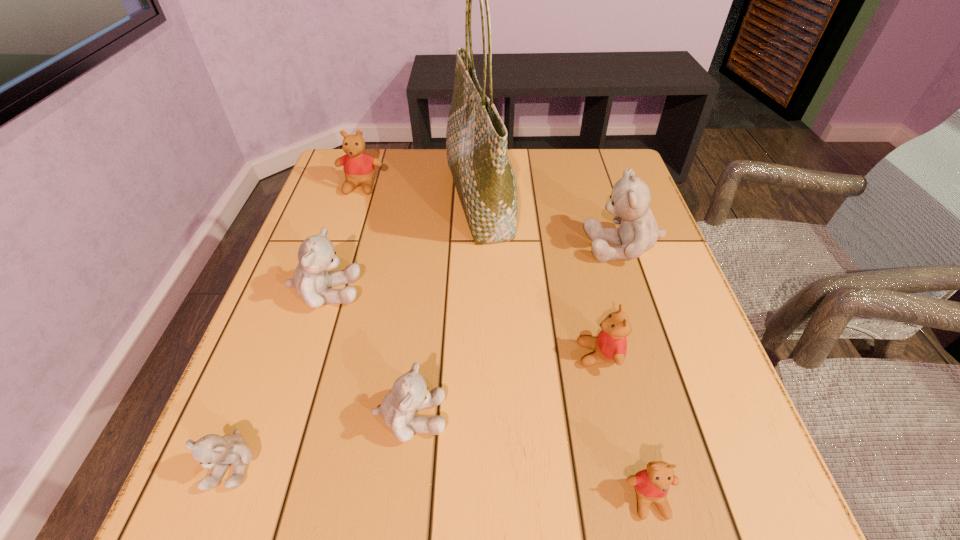
Where is `free space that is in between the shopping bag and the second farthest gray teddy bear`? This screenshot has height=540, width=960. free space that is in between the shopping bag and the second farthest gray teddy bear is located at coordinates (402, 246).

Where is `free space between the nearest red teddy bear and the fourth nearest object`? Image resolution: width=960 pixels, height=540 pixels. free space between the nearest red teddy bear and the fourth nearest object is located at coordinates (624, 427).

Where is `free spot between the tallest object and the smallest red teddy bear`? Image resolution: width=960 pixels, height=540 pixels. free spot between the tallest object and the smallest red teddy bear is located at coordinates [564, 349].

Where is `vacant space that is in between the farthest teddy bear and the smallest gray teddy bear`? The image size is (960, 540). vacant space that is in between the farthest teddy bear and the smallest gray teddy bear is located at coordinates (297, 325).

Where is `free area in between the smallest gray teddy bear and the nearest red teddy bear`? This screenshot has height=540, width=960. free area in between the smallest gray teddy bear and the nearest red teddy bear is located at coordinates (441, 481).

You are a GUI agent. You are given a task and a screenshot of the screen. Output one action in this format:
    pyautogui.click(x=<x>, y=<y>)
    Task: Click on the sixth closest object relative to the second farthest teddy bear
    This screenshot has height=540, width=960.
    Given the screenshot: What is the action you would take?
    pyautogui.click(x=358, y=166)

Identify the location of the third closest object relative to the nearest red teddy bear. The width and height of the screenshot is (960, 540). (629, 202).

Point out which teddy bear is positioned as the second nearest to the smallest red teddy bear. Please provide its 2D coordinates. Your answer should be formatted as a tuple, i.e. [(x, y)], where the tuple contains the x and y coordinates of a point satisfying the conditions above.

[(409, 394)]

Locate which teddy bear is the fifth closest to the second smallest gray teddy bear. Please provide its 2D coordinates. Your answer should be formatted as a tuple, i.e. [(x, y)], where the tuple contains the x and y coordinates of a point satisfying the conditions above.

[(629, 202)]

Locate which gray teddy bear is the closest to the second biggest gray teddy bear. Please provide its 2D coordinates. Your answer should be formatted as a tuple, i.e. [(x, y)], where the tuple contains the x and y coordinates of a point satisfying the conditions above.

[(409, 394)]